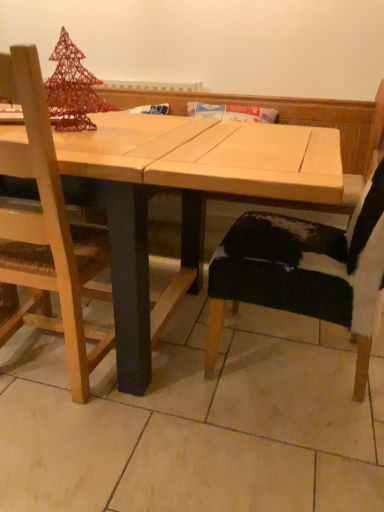
Find the location of a particular element. The width and height of the screenshot is (384, 512). free space in front of cowhide black chair at lower right, arranged as the 2th chair when viewed from the left is located at coordinates (290, 460).